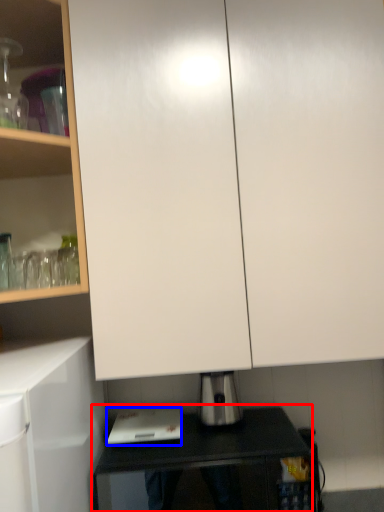
Question: Which object is further to the camera taking this photo, table (highlighted by a red box) or home appliance (highlighted by a blue box)?

Choices:
 (A) table
 (B) home appliance

Answer: (B)